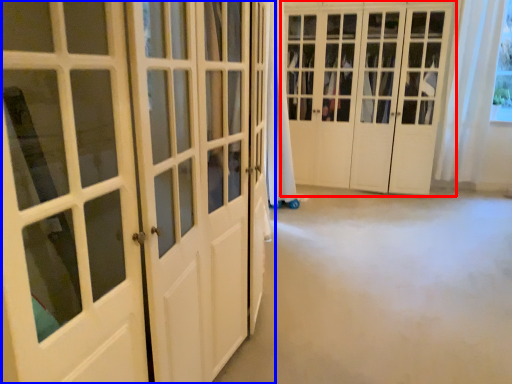
Question: Which of the following is the farthest to the observer, door (highlighted by a red box) or door (highlighted by a blue box)?

Choices:
 (A) door
 (B) door

Answer: (A)